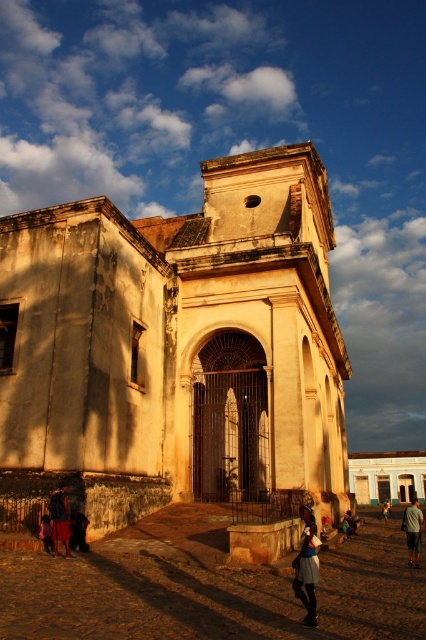
Who is taller, matte brown skirt at lower left or matte red shorts at lower left?

Standing taller between the two is matte brown skirt at lower left.

In the scene shown: Is matte brown skirt at lower left above matte red shorts at lower left?

Correct, matte brown skirt at lower left is located above matte red shorts at lower left.

Which is in front, point (66, 506) or point (46, 538)?

Point (66, 506)

This screenshot has height=640, width=426. Find the location of `matte brown skirt at lower left`. matte brown skirt at lower left is located at coordinates (60, 518).

Which is above, matte red shorts at lower left or blue denim shorts at center?

matte red shorts at lower left is above.

Is point (45, 532) positioned after point (385, 500)?

No.

Which is behind, point (43, 540) or point (388, 509)?

Point (388, 509)

You are a GUI agent. You are given a task and a screenshot of the screen. Output one action in this format:
    pyautogui.click(x=<x>, y=<y>)
    Task: Click on the matte red shorts at lower left
    
    Given the screenshot: What is the action you would take?
    pyautogui.click(x=46, y=532)

Is dark brown leather jacket at lower left wider than blue denim skirt at center?

No.

This screenshot has width=426, height=640. I want to click on dark brown leather jacket at lower left, so click(77, 531).